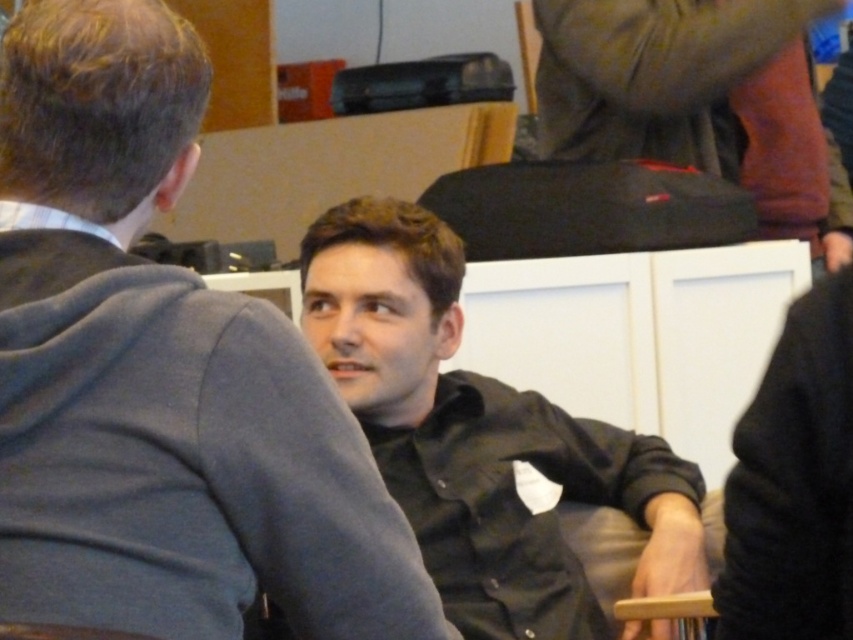
Question: Is black shirt at center to the right of black matte shirt at center from the viewer's perspective?

Choices:
 (A) no
 (B) yes

Answer: (A)

Question: Which object is closer to the camera taking this photo?

Choices:
 (A) black shirt at center
 (B) dark gray fabric pants at upper right

Answer: (A)

Question: Can you confirm if black shirt at center is positioned to the right of black matte shirt at center?

Choices:
 (A) yes
 (B) no

Answer: (B)

Question: Which object is closer to the camera taking this photo?

Choices:
 (A) black matte shirt at center
 (B) black shirt at center

Answer: (B)

Question: Which point appears closest to the camera in this image?

Choices:
 (A) (671, 456)
 (B) (140, 444)

Answer: (B)

Question: Can you confirm if black matte shirt at center is positioned to the right of dark gray fabric pants at upper right?

Choices:
 (A) no
 (B) yes

Answer: (A)